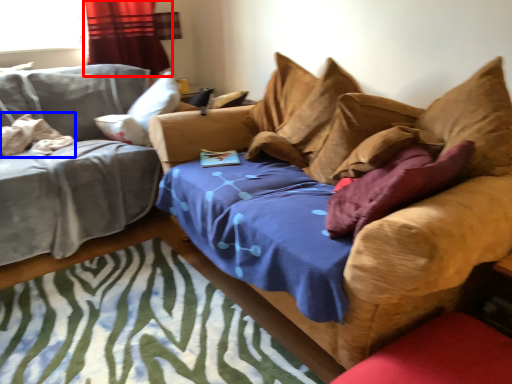
Question: Among these objects, which one is farthest to the camera, curtain (highlighted by a red box) or pillow (highlighted by a blue box)?

Choices:
 (A) curtain
 (B) pillow

Answer: (A)